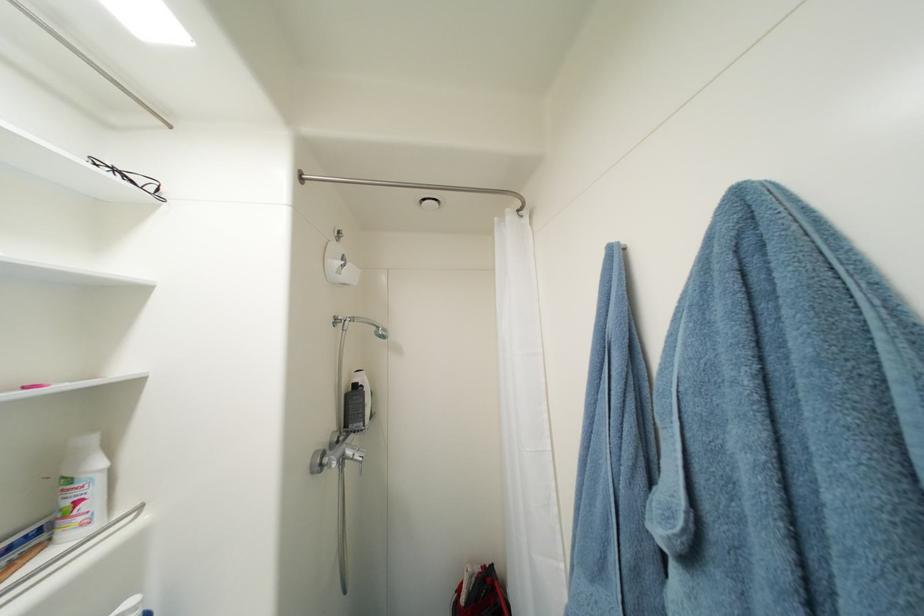
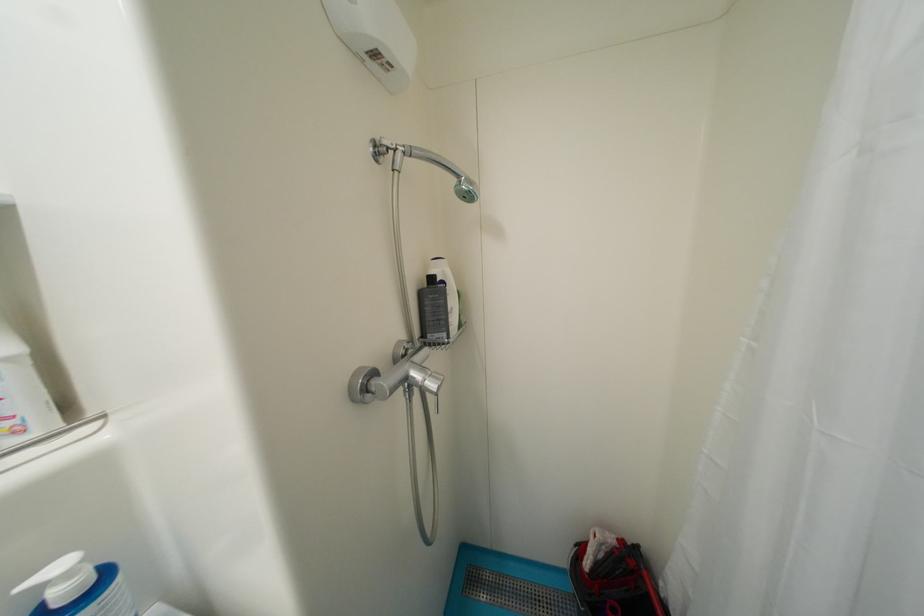
Where in the second image is the point corresponding to the point at 361,387 from the first image?

(439, 281)